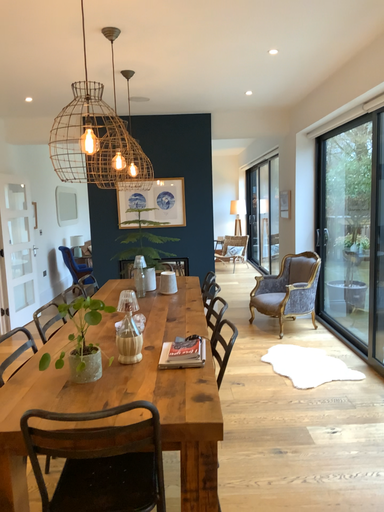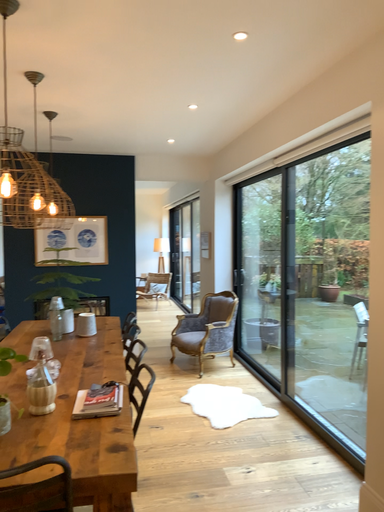
Question: Which way did the camera rotate in the video?

Choices:
 (A) rotated left
 (B) rotated right

Answer: (B)